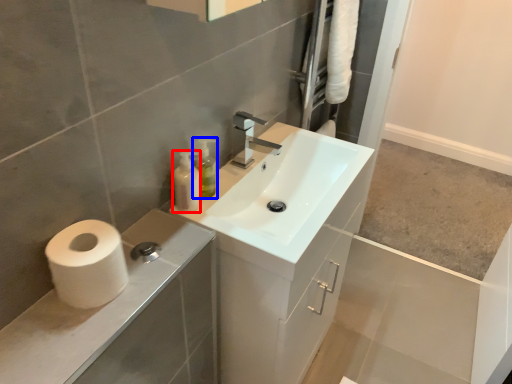
Question: Which of the following is the farthest to the observer, toiletry (highlighted by a red box) or soap dispenser (highlighted by a blue box)?

Choices:
 (A) toiletry
 (B) soap dispenser

Answer: (B)